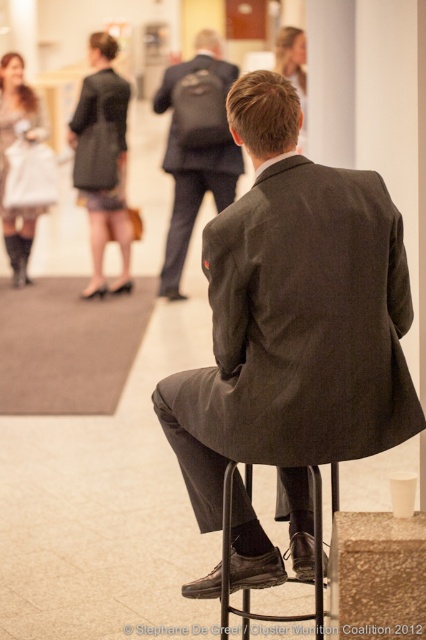
Does matte black suit at center appear on the right side of black leather bar stool at lower center?

No, matte black suit at center is not to the right of black leather bar stool at lower center.

Does point (212, 182) lie in front of point (249, 492)?

That is False.

Locate an element on the screen. The width and height of the screenshot is (426, 640). matte black suit at center is located at coordinates (195, 147).

Between point (91, 99) and point (316, 589), which one is positioned behind?

The point (91, 99) is behind.

Is dark gray textured coat at upper left to the left of black leather bar stool at lower center from the viewer's perspective?

Correct, you'll find dark gray textured coat at upper left to the left of black leather bar stool at lower center.

Is point (74, 132) behind point (273, 618)?

Yes, it is.

Image resolution: width=426 pixels, height=640 pixels. Identify the location of dark gray textured coat at upper left. (103, 161).

Image resolution: width=426 pixels, height=640 pixels. Describe the element at coordinates (293, 323) in the screenshot. I see `dark gray suit at center` at that location.

The width and height of the screenshot is (426, 640). Identify the location of dark gray suit at center. [x=293, y=323].

Is point (293, 108) more distant than point (94, 128)?

No, it is in front of (94, 128).

Locate an element on the screen. dark gray suit at center is located at coordinates (293, 323).